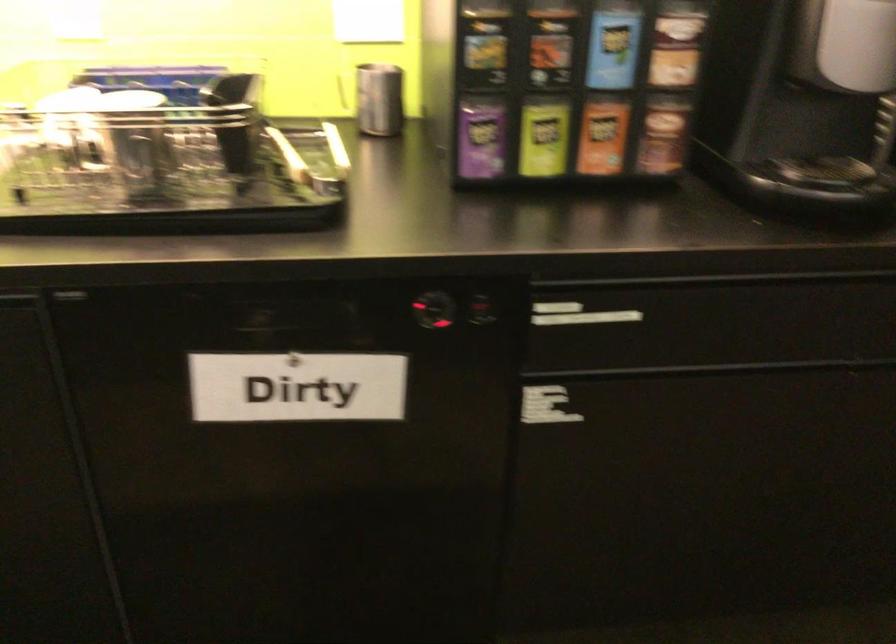
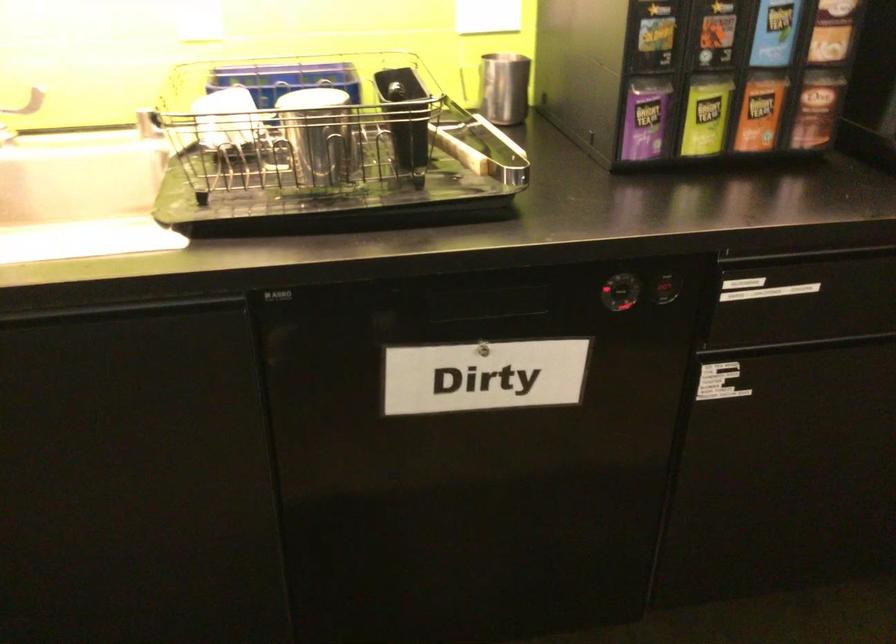
Where in the second image is the point corresponding to the point at 481,137 from the first image?

(645, 118)